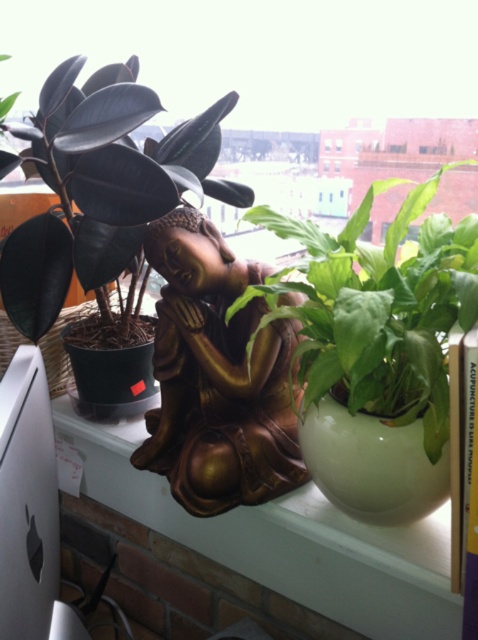
You are standing in the room and want to determine which point is closer to you. The points are point (112, 150) and point (180, 230). Which one is closer?

Point (112, 150) is closer to you than point (180, 230).